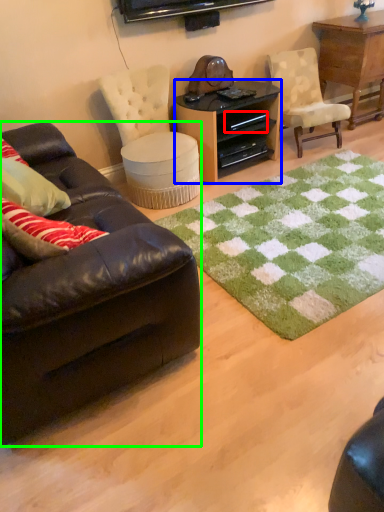
Question: Based on their relative distances, which object is nearer to drawer (highlighted by a red box)? Choose from desk (highlighted by a blue box) and studio couch (highlighted by a green box).

Choices:
 (A) desk
 (B) studio couch

Answer: (A)